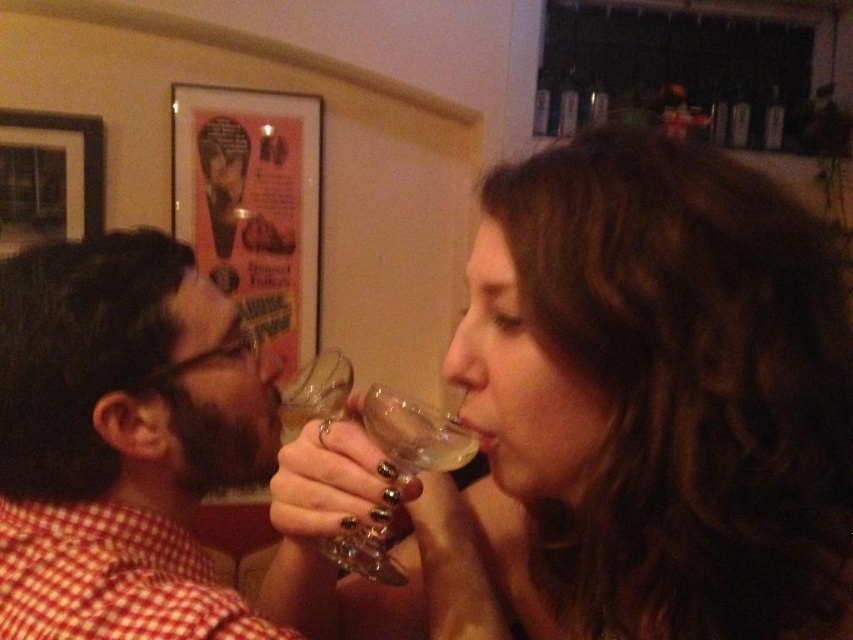
Does translucent glass at upper right have a greater height compared to transparent glass wine glass at center?

Correct, translucent glass at upper right is much taller as transparent glass wine glass at center.

Is point (735, 216) behind point (444, 442)?

No, it is not.

The width and height of the screenshot is (853, 640). In order to click on translucent glass at upper right in this screenshot , I will do `click(686, 388)`.

Is transparent glass wine glass at center below transparent glass at center?

Yes, transparent glass wine glass at center is below transparent glass at center.

Is point (393, 451) more distant than point (352, 381)?

No.

Locate an element on the screen. This screenshot has height=640, width=853. transparent glass wine glass at center is located at coordinates (398, 474).

Describe the element at coordinates (122, 440) in the screenshot. I see `matte glass wine at left` at that location.

From the picture: Can you confirm if matte glass wine at left is smaller than transparent glass at center?

Correct, matte glass wine at left occupies less space than transparent glass at center.

Where is `matte glass wine at left`? This screenshot has height=640, width=853. matte glass wine at left is located at coordinates (122, 440).